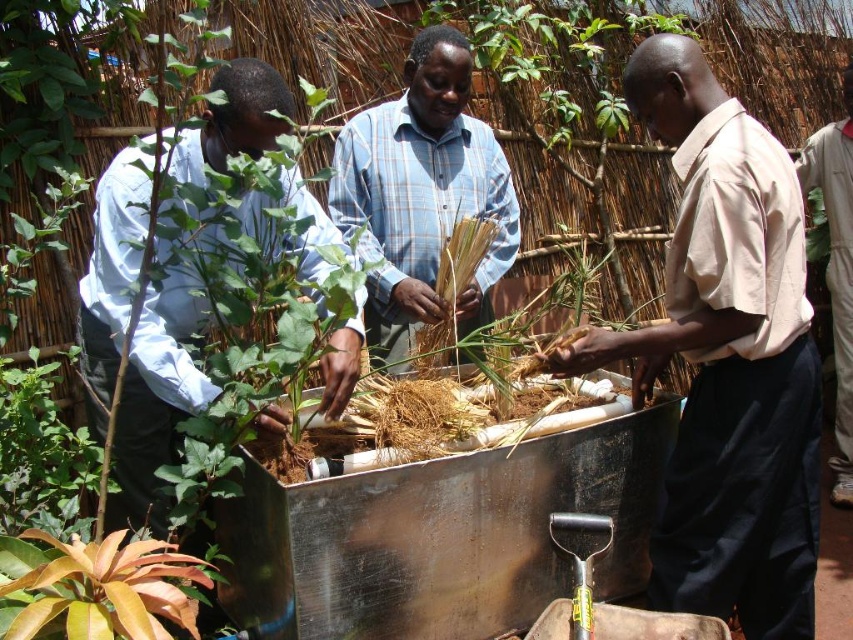
You are standing in the field and see the point at coordinates point (151, 456). Can you reach it without moving closer than 2 meters?

The point at coordinates point (151, 456) is 2.29 meters away from you, so yes, you can reach it without moving closer than 2 meters.

Please look at the three people in the image. The light blue shirt at left is represented by point (155,400). The light blue and white checkered shirt in center is represented by point 0.5, 0.5. The individual on the right is represented by point 0.3, 0.7. Which person is closest to the center of the image?

The light blue and white checkered shirt in center is closest to the center of the image because its coordinates are 0.5, 0.5, which is exactly at the center point of the image.

You are a farmer inspecting the hydroponic system. You notice the light blue shirt at left and the leathery brown leaf at lower left. Which object is bigger in size?

The light blue shirt at left is larger in size compared to the leathery brown leaf at lower left according to the description.